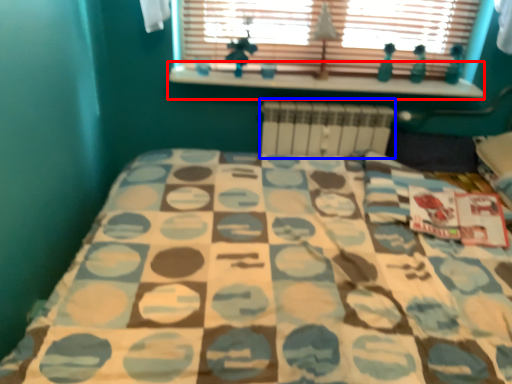
Question: Which of the following is the farthest to the observer, window sill (highlighted by a red box) or radiator (highlighted by a blue box)?

Choices:
 (A) window sill
 (B) radiator

Answer: (B)